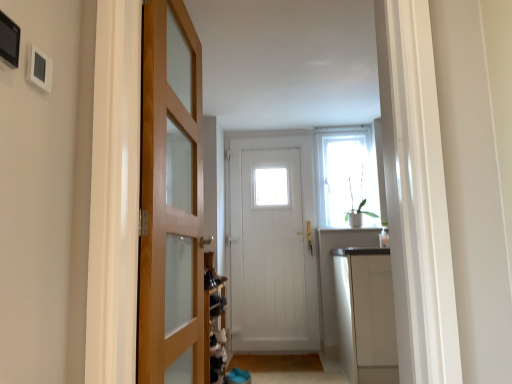
Where is `free space below white wooden door at center, arranged as the 2th door when viewed from the front (from a real-world perspective)`? The image size is (512, 384). free space below white wooden door at center, arranged as the 2th door when viewed from the front (from a real-world perspective) is located at coordinates (273, 347).